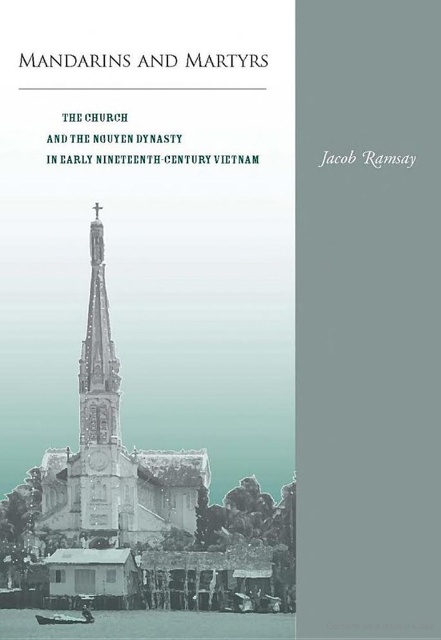
Is clear water at lower center to the right of wooden boat at lower left from the viewer's perspective?

Indeed, clear water at lower center is positioned on the right side of wooden boat at lower left.

Who is higher up, clear water at lower center or wooden boat at lower left?

wooden boat at lower left

Which is in front, point (205, 625) or point (51, 621)?

Point (51, 621) is in front.

Locate an element on the screen. The image size is (441, 640). clear water at lower center is located at coordinates pos(152,625).

In the scene shown: Which is above, stone church steeple at center or clear water at lower center?

stone church steeple at center is higher up.

Who is taller, stone church steeple at center or clear water at lower center?

Standing taller between the two is stone church steeple at center.

Where is `stone church steeple at center`? Image resolution: width=441 pixels, height=640 pixels. stone church steeple at center is located at coordinates (112, 449).

Locate an element on the screen. Image resolution: width=441 pixels, height=640 pixels. stone church steeple at center is located at coordinates (112, 449).

Who is lower down, stone church steeple at center or wooden boat at lower left?

wooden boat at lower left is lower down.

At what (x,y) coordinates should I click in order to perform the action: click on stone church steeple at center. Please return your answer as a coordinate pair (x, y). This screenshot has height=640, width=441. Looking at the image, I should click on pos(112,449).